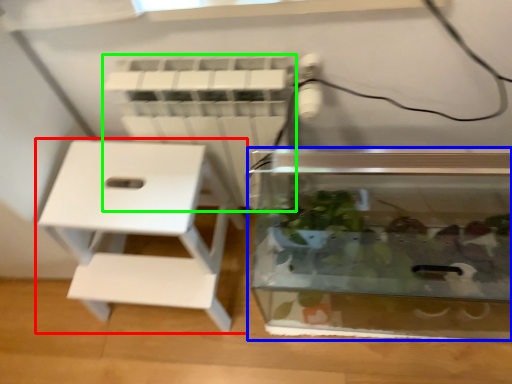
Question: Which is nearer to the furniture (highlighted by a red box)? glass box (highlighted by a blue box) or radiator (highlighted by a green box).

Choices:
 (A) glass box
 (B) radiator

Answer: (B)